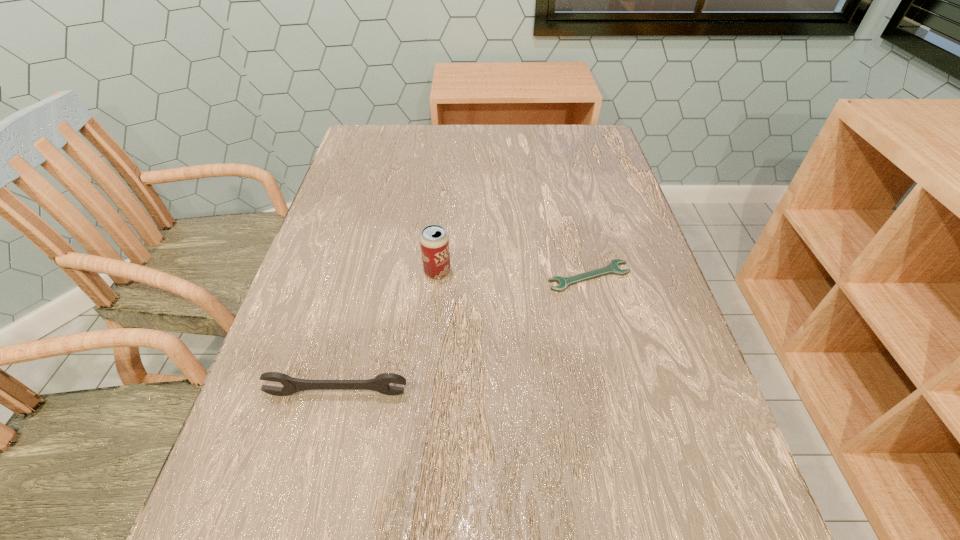
Locate an element on the screen. Image resolution: width=960 pixels, height=540 pixels. free space that is in between the farther wrench and the taller wrench is located at coordinates (464, 335).

Identify the location of free space between the beer can and the shortest object. This screenshot has width=960, height=540. (514, 274).

Where is `free space between the shorter wrench and the beer can`? This screenshot has width=960, height=540. free space between the shorter wrench and the beer can is located at coordinates (514, 274).

You are a GUI agent. You are given a task and a screenshot of the screen. Output one action in this format:
    pyautogui.click(x=<x>, y=<y>)
    Task: Click on the vacant space that is in between the farther wrench and the beer can
    Image resolution: width=960 pixels, height=540 pixels.
    Given the screenshot: What is the action you would take?
    pyautogui.click(x=514, y=274)

The image size is (960, 540). In order to click on free space between the nearer wrench and the second object from left to right in this screenshot , I will do (387, 333).

Where is `free space between the rightmost object and the beer can`? Image resolution: width=960 pixels, height=540 pixels. free space between the rightmost object and the beer can is located at coordinates (514, 274).

Point out which object is positioned as the nearest to the nearer wrench. Please provide its 2D coordinates. Your answer should be formatted as a tuple, i.e. [(x, y)], where the tuple contains the x and y coordinates of a point satisfying the conditions above.

[(434, 241)]

You are a GUI agent. You are given a task and a screenshot of the screen. Output one action in this format:
    pyautogui.click(x=<x>, y=<y>)
    Task: Click on the object that stands as the closest to the shorter wrench
    
    Given the screenshot: What is the action you would take?
    pyautogui.click(x=434, y=241)